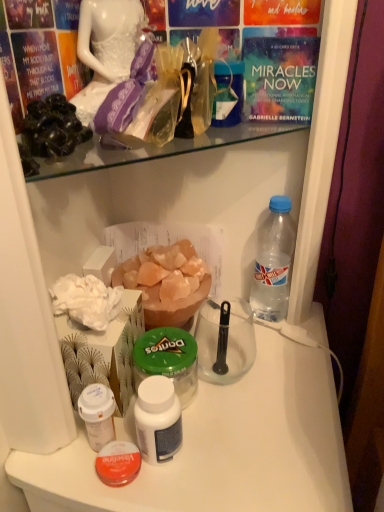
What do you see at coordinates (221, 448) in the screenshot?
I see `white plastic table at center` at bounding box center [221, 448].

You are a GUI agent. You are given a task and a screenshot of the screen. Output one action in this format:
    pyautogui.click(x=<x>, y=<y>)
    Task: Click on the green plastic jar at center, which ranks as the third bottle in left-to-right order
    Image resolution: width=384 pixels, height=512 pixels.
    Given the screenshot: What is the action you would take?
    pyautogui.click(x=168, y=360)

Find the location of a particular element. Image resolution: width=384 pixels, height=512 pixels. pink crystal salt at center is located at coordinates point(166,282).

This screenshot has height=512, width=384. What do you see at coordinates (106, 49) in the screenshot?
I see `white lace dress at upper left` at bounding box center [106, 49].

Identify the location of white lace dress at upper left. (106, 49).

Locate an element on the screen. black matte rock at upper left is located at coordinates (53, 127).

Is white plastic table at center not near white lace dress at upper left?

That's not correct — white plastic table at center is a little close to white lace dress at upper left.

Which of these two, white plastic table at center or white lace dress at upper left, stands shorter?

Standing shorter between the two is white lace dress at upper left.

Is white plastic table at center to the left of white lace dress at upper left from the viewer's perspective?

No.

How many degrees apart are the facing directions of white plastic table at center and white lace dress at upper left?

53.6 degrees.

Who is more distant, white lace dress at upper left or black matte rock at upper left?

white lace dress at upper left is further away from the camera.

Is white lace dress at upper left aimed at black matte rock at upper left?

No, white lace dress at upper left is not oriented towards black matte rock at upper left.

Is white lace dress at upper left wider than black matte rock at upper left?

No.

Between clear plastic bottle at right, the first bottle when ordered from right to left, and white plastic cup at lower left, arranged as the 4th bottle when viewed from the right, which one has smaller width?

white plastic cup at lower left, arranged as the 4th bottle when viewed from the right.

Which is correct: clear plastic bottle at right, which ranks as the 4th bottle in left-to-right order, is inside white plastic cup at lower left, arranged as the 4th bottle when viewed from the right, or outside of it?

clear plastic bottle at right, which ranks as the 4th bottle in left-to-right order, is not inside white plastic cup at lower left, arranged as the 4th bottle when viewed from the right, it's outside.

From the image's perspective, who appears lower, clear plastic bottle at right, the first bottle when ordered from right to left, or white plastic cup at lower left, arranged as the 4th bottle when viewed from the right?

white plastic cup at lower left, arranged as the 4th bottle when viewed from the right, from the image's perspective.

From a real-world perspective, is clear plastic bottle at right, the first bottle when ordered from right to left, physically below white plastic cup at lower left, arranged as the 4th bottle when viewed from the right?

Answer: No, from a real-world perspective, clear plastic bottle at right, the first bottle when ordered from right to left, is not beneath white plastic cup at lower left, arranged as the 4th bottle when viewed from the right.

Between point (280, 226) and point (232, 485), which one is positioned in front?

Positioned in front is point (232, 485).

In terms of height, does clear plastic bottle at right, the first bottle when ordered from right to left, look taller or shorter compared to white plastic table at center?

Clearly, clear plastic bottle at right, the first bottle when ordered from right to left, is shorter compared to white plastic table at center.

From a real-world perspective, is clear plastic bottle at right, the first bottle when ordered from right to left, positioned above or below white plastic table at center?

clear plastic bottle at right, the first bottle when ordered from right to left, is situated higher than white plastic table at center in the real world.

Does point (81, 22) appear closer or farther from the camera than point (188, 394)?

Point (81, 22).

From a real-world perspective, is white lace dress at upper left above or below green plastic jar at center, arranged as the 2th bottle when viewed from the right?

white lace dress at upper left is above green plastic jar at center, arranged as the 2th bottle when viewed from the right.

Considering the relative sizes of white lace dress at upper left and green plastic jar at center, which ranks as the third bottle in left-to-right order, in the image provided, is white lace dress at upper left bigger than green plastic jar at center, which ranks as the third bottle in left-to-right order,?

No, white lace dress at upper left is not bigger than green plastic jar at center, which ranks as the third bottle in left-to-right order.

Could you tell me if white lace dress at upper left is turned towards green plastic jar at center, which ranks as the third bottle in left-to-right order?

No, white lace dress at upper left is not turned towards green plastic jar at center, which ranks as the third bottle in left-to-right order.

From the image's perspective, does pink crystal salt at center appear higher than white plastic bottle at center, the 3th bottle positioned from the right?

Yes, from the image's perspective, pink crystal salt at center is above white plastic bottle at center, the 3th bottle positioned from the right.

Which is behind, point (160, 290) or point (164, 410)?

Point (160, 290)

From a real-world perspective, is pink crystal salt at center on top of white plastic bottle at center, which is the second bottle from left to right?

Yes, from a real-world perspective, pink crystal salt at center is over white plastic bottle at center, which is the second bottle from left to right

Choose the correct answer: Is pink crystal salt at center inside white plastic cup at lower left, the first bottle when ordered from left to right, or outside it?

pink crystal salt at center cannot be found inside white plastic cup at lower left, the first bottle when ordered from left to right.

Considering the positions of points (147, 298) and (80, 406), is point (147, 298) closer to camera compared to point (80, 406)?

No.

How different are the orientations of pink crystal salt at center and white plastic cup at lower left, the first bottle when ordered from left to right, in degrees?

There is a 90.6-degree angle between the facing directions of pink crystal salt at center and white plastic cup at lower left, the first bottle when ordered from left to right.

You are a GUI agent. You are given a task and a screenshot of the screen. Output one action in this format:
    pyautogui.click(x=<x>, y=<y>)
    Task: Click on the fancy dress above the white plastic table at center (from a real-world perspective)
    The image size is (384, 512).
    Given the screenshot: What is the action you would take?
    pyautogui.click(x=106, y=49)

You are a GUI agent. You are given a task and a screenshot of the screen. Output one action in this format:
    pyautogui.click(x=<x>, y=<y>)
    Task: Click on the fancy dress above the black matte rock at upper left (from the image's perspective)
    This screenshot has height=512, width=384.
    Given the screenshot: What is the action you would take?
    pyautogui.click(x=106, y=49)

Looking at the image, which one is located closer to white plastic table at center, pink crystal salt at center or green plastic jar at center, arranged as the 2th bottle when viewed from the right?

green plastic jar at center, arranged as the 2th bottle when viewed from the right, is closer to white plastic table at center.

Based on their spatial positions, is white plastic bottle at center, the 3th bottle positioned from the right, or clear plastic bottle at right, which ranks as the 4th bottle in left-to-right order, further from white plastic cup at lower left, the first bottle when ordered from left to right?

clear plastic bottle at right, which ranks as the 4th bottle in left-to-right order.

Estimate the real-world distances between objects in this image. Which object is closer to clear plastic bottle at right, which ranks as the 4th bottle in left-to-right order, white plastic bottle at center, which is the second bottle from left to right, or pink crystal salt at center?

Among the two, pink crystal salt at center is located nearer to clear plastic bottle at right, which ranks as the 4th bottle in left-to-right order.

Looking at the image, which one is located further to clear plastic bottle at right, the first bottle when ordered from right to left, white plastic cup at lower left, the first bottle when ordered from left to right, or pink crystal salt at center?

white plastic cup at lower left, the first bottle when ordered from left to right, is further to clear plastic bottle at right, the first bottle when ordered from right to left.

Which object lies nearer to the anchor point white plastic bottle at center, which is the second bottle from left to right, white lace dress at upper left or green plastic jar at center, which ranks as the third bottle in left-to-right order?

green plastic jar at center, which ranks as the third bottle in left-to-right order, lies closer to white plastic bottle at center, which is the second bottle from left to right, than the other object.

Based on their spatial positions, is white plastic table at center or white plastic bottle at center, the 3th bottle positioned from the right, further from clear plastic bottle at right, which ranks as the 4th bottle in left-to-right order?

Based on the image, white plastic bottle at center, the 3th bottle positioned from the right, appears to be further to clear plastic bottle at right, which ranks as the 4th bottle in left-to-right order.

Based on their spatial positions, is white lace dress at upper left or clear plastic bottle at right, which ranks as the 4th bottle in left-to-right order, closer to green plastic jar at center, which ranks as the third bottle in left-to-right order?

The object closer to green plastic jar at center, which ranks as the third bottle in left-to-right order, is clear plastic bottle at right, which ranks as the 4th bottle in left-to-right order.

Which object lies further to the anchor point white plastic table at center, clear plastic bottle at right, which ranks as the 4th bottle in left-to-right order, or white plastic cup at lower left, the first bottle when ordered from left to right?

Based on the image, clear plastic bottle at right, which ranks as the 4th bottle in left-to-right order, appears to be further to white plastic table at center.

This screenshot has width=384, height=512. Find the location of `food located between green plastic jar at center, which ranks as the third bottle in left-to-right order, and clear plastic bottle at right, which ranks as the 4th bottle in left-to-right order, in the left-right direction`. food located between green plastic jar at center, which ranks as the third bottle in left-to-right order, and clear plastic bottle at right, which ranks as the 4th bottle in left-to-right order, in the left-right direction is located at coordinates (166, 282).

At what (x,y) coordinates should I click in order to perform the action: click on food between white lace dress at upper left and green plastic jar at center, which ranks as the third bottle in left-to-right order, in the up-down direction. Please return your answer as a coordinate pair (x, y). The image size is (384, 512). Looking at the image, I should click on (166, 282).

Find the location of `food located between white plastic cup at lower left, the first bottle when ordered from left to right, and clear plastic bottle at right, the first bottle when ordered from right to left, in the left-right direction`. food located between white plastic cup at lower left, the first bottle when ordered from left to right, and clear plastic bottle at right, the first bottle when ordered from right to left, in the left-right direction is located at coordinates (166, 282).

This screenshot has height=512, width=384. What are the coordinates of `food between clear plastic bottle at right, the first bottle when ordered from right to left, and white plastic table at center in the up-down direction` in the screenshot? It's located at (166, 282).